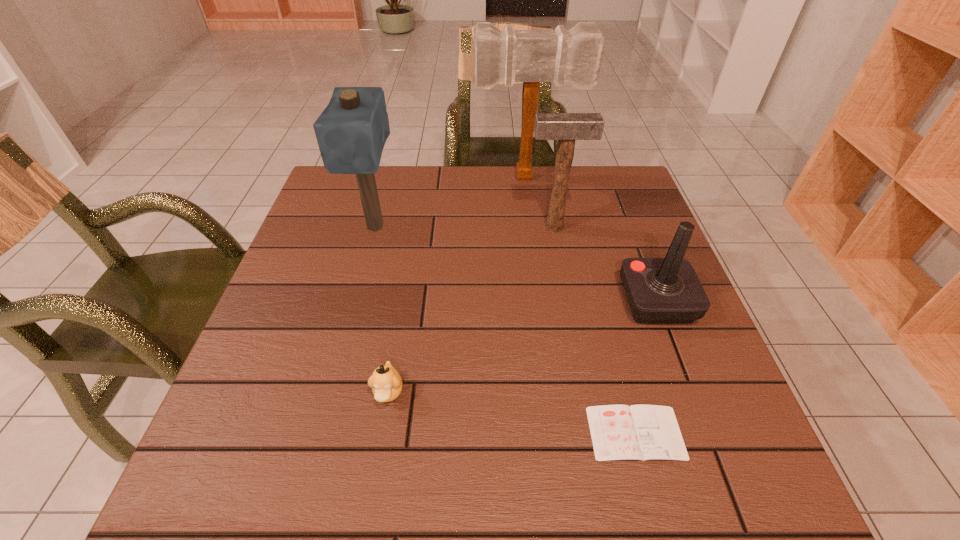
At what (x,y) coordinates should I click in order to perform the action: click on object that is at the near right corner. Please return your answer as a coordinate pair (x, y). This screenshot has width=960, height=540. Looking at the image, I should click on (619, 432).

Image resolution: width=960 pixels, height=540 pixels. I want to click on free point at the far edge, so (438, 201).

Where is `vacant space at the near edge of the desktop`? The image size is (960, 540). vacant space at the near edge of the desktop is located at coordinates (434, 475).

Find the location of `vacant space at the left edge of the desktop`. vacant space at the left edge of the desktop is located at coordinates (355, 259).

Image resolution: width=960 pixels, height=540 pixels. In the image, there is a desktop. In order to click on free space at the right edge in this screenshot , I will do `click(597, 232)`.

The width and height of the screenshot is (960, 540). Find the location of `free region at the far right corner of the desktop`. free region at the far right corner of the desktop is located at coordinates (610, 178).

I want to click on unoccupied position between the fourth shortest object and the second shortest mallet, so click(465, 227).

Locate an element on the screen. free spot between the fifth tallest object and the shortest object is located at coordinates (512, 413).

At what (x,y) coordinates should I click in order to perform the action: click on free spot between the third nearest object and the farthest object. Please return your answer as a coordinate pair (x, y). Looking at the image, I should click on (591, 239).

Where is `empty space that is in between the farthest object and the second shortest mallet`? empty space that is in between the farthest object and the second shortest mallet is located at coordinates (451, 202).